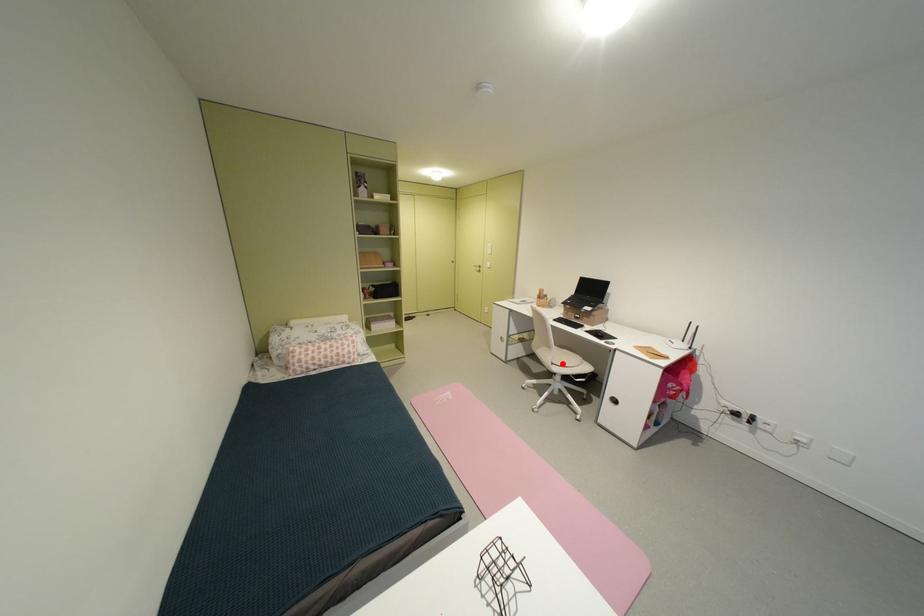
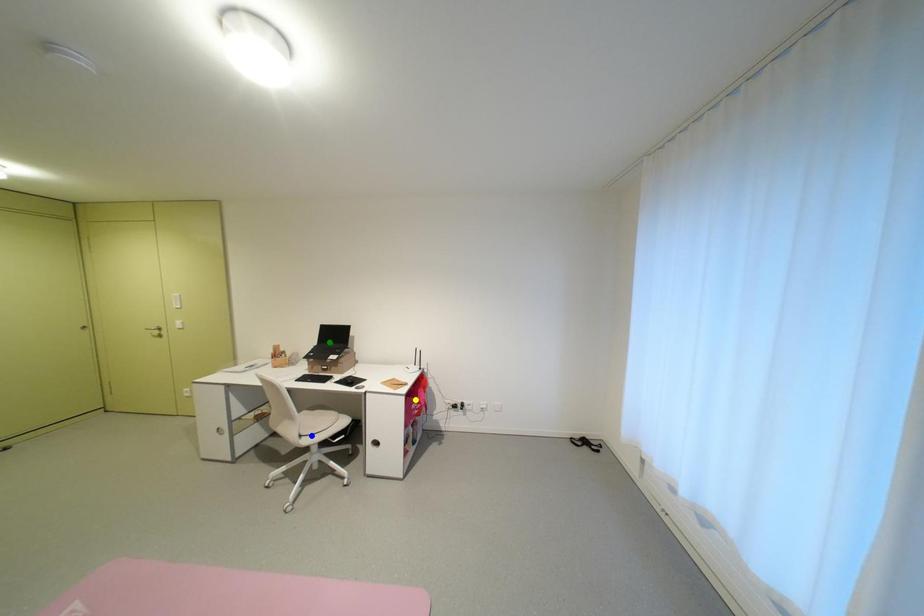
Question: I am providing you with two images of the same scene from different viewpoints. A red point is marked on the first image. You are given multiple points on the second image. Which point in image 2 represents the same 3d spot as the red point in image 1?

Choices:
 (A) green point
 (B) blue point
 (C) yellow point

Answer: (B)